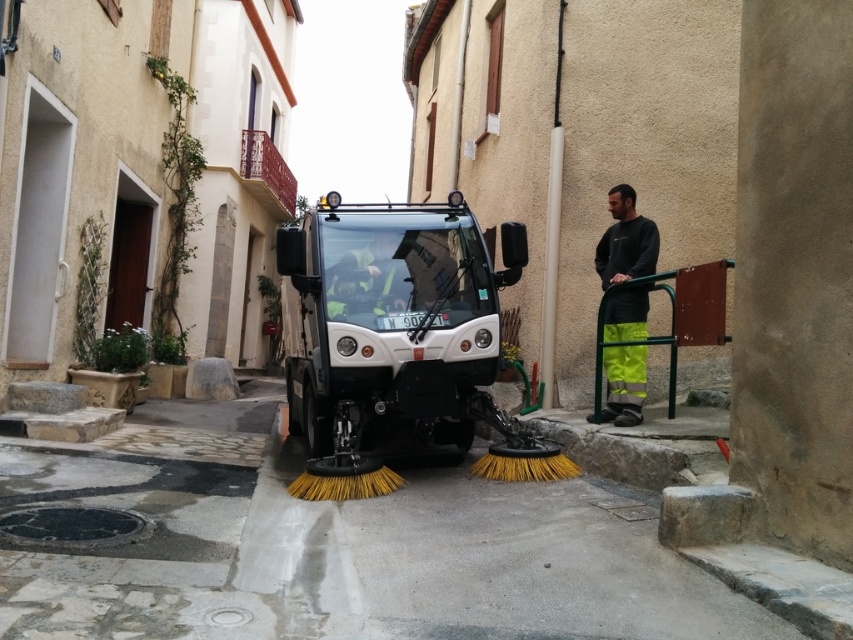
Is white matte garbage truck at center taller than dark gray sweatshirt at right?

Correct, white matte garbage truck at center is much taller as dark gray sweatshirt at right.

In the scene shown: Does white matte garbage truck at center appear over dark gray sweatshirt at right?

No, white matte garbage truck at center is not above dark gray sweatshirt at right.

Who is more forward, (x=492, y=234) or (x=643, y=337)?

Point (x=643, y=337) is in front.

The width and height of the screenshot is (853, 640). In order to click on white matte garbage truck at center in this screenshot , I will do `click(395, 323)`.

Which is above, dark gray sweatshirt at right or reflective yellow vest at center?

reflective yellow vest at center

Based on the photo, who is lower down, dark gray sweatshirt at right or reflective yellow vest at center?

dark gray sweatshirt at right is lower down.

At what (x,y) coordinates should I click in order to perform the action: click on dark gray sweatshirt at right. Please return your answer as a coordinate pair (x, y). The image size is (853, 640). Looking at the image, I should click on (625, 241).

Does white matte garbage truck at center appear under reflective yellow vest at center?

Correct, white matte garbage truck at center is located below reflective yellow vest at center.

Between white matte garbage truck at center and reflective yellow vest at center, which one has more height?

Standing taller between the two is white matte garbage truck at center.

Image resolution: width=853 pixels, height=640 pixels. I want to click on white matte garbage truck at center, so (x=395, y=323).